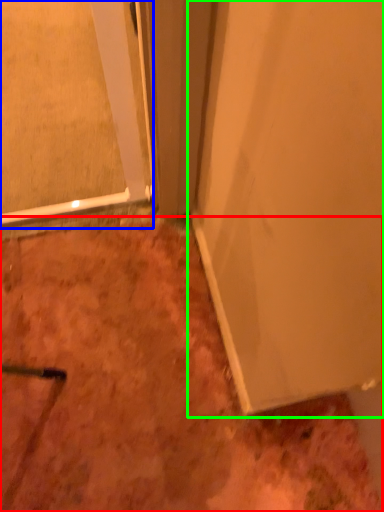
Question: Which is farther away from dirt (highlighted by a red box)? glass door (highlighted by a blue box) or door (highlighted by a green box)?

Choices:
 (A) glass door
 (B) door

Answer: (A)